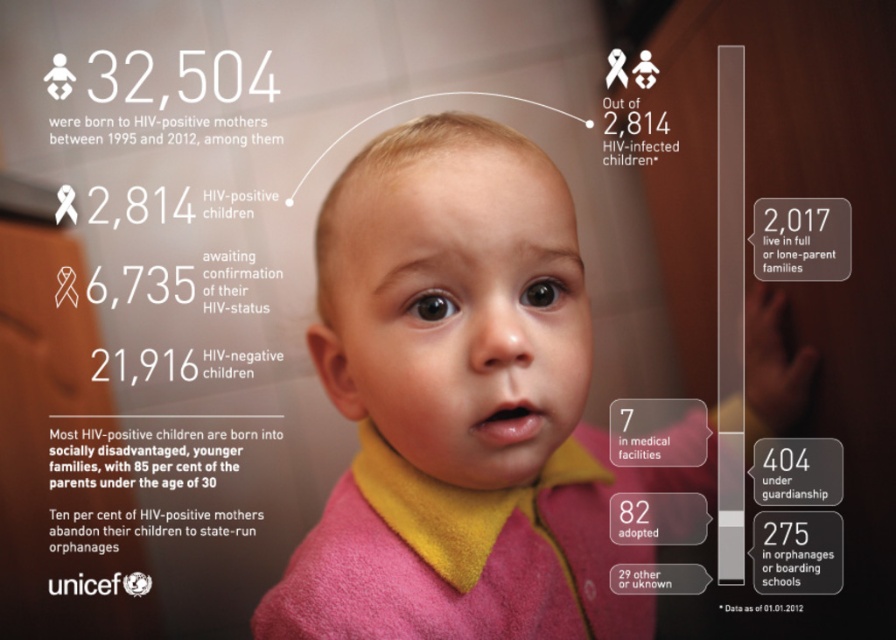
Question: Is pink fleece jacket at center behind pink fleece robe at center?

Choices:
 (A) yes
 (B) no

Answer: (B)

Question: Among these objects, which one is nearest to the camera?

Choices:
 (A) pink fleece jacket at center
 (B) pink fleece robe at center

Answer: (A)

Question: Among these objects, which one is nearest to the camera?

Choices:
 (A) pink fleece jacket at center
 (B) pink fleece robe at center

Answer: (A)

Question: Does pink fleece jacket at center appear on the right side of pink fleece robe at center?

Choices:
 (A) no
 (B) yes

Answer: (B)

Question: Which point appears closest to the camera in this image?

Choices:
 (A) (504, 563)
 (B) (322, 570)

Answer: (B)

Question: Can you confirm if pink fleece jacket at center is positioned to the right of pink fleece robe at center?

Choices:
 (A) no
 (B) yes

Answer: (B)